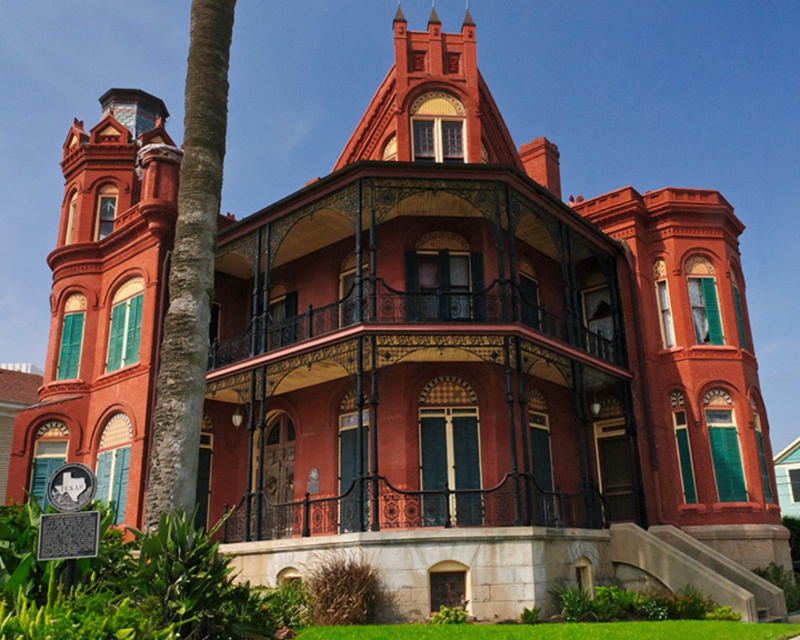
Question: Which object is positioned closest to the matte red balcony at center?

Choices:
 (A) green textured palm tree at left
 (B) polished wrought iron porch at center

Answer: (B)

Question: Does green textured palm tree at left appear over polished wrought iron porch at center?

Choices:
 (A) no
 (B) yes

Answer: (B)

Question: Which point appears closest to the camera in this image?

Choices:
 (A) (380, 410)
 (B) (306, 516)

Answer: (B)

Question: Does matte red balcony at center appear over green textured palm tree at left?

Choices:
 (A) no
 (B) yes

Answer: (A)

Question: Which object is farther from the camera taking this photo?

Choices:
 (A) polished wrought iron porch at center
 (B) matte red balcony at center
 (C) green textured palm tree at left

Answer: (B)

Question: Is green textured palm tree at left positioned at the back of polished wrought iron porch at center?

Choices:
 (A) yes
 (B) no

Answer: (B)